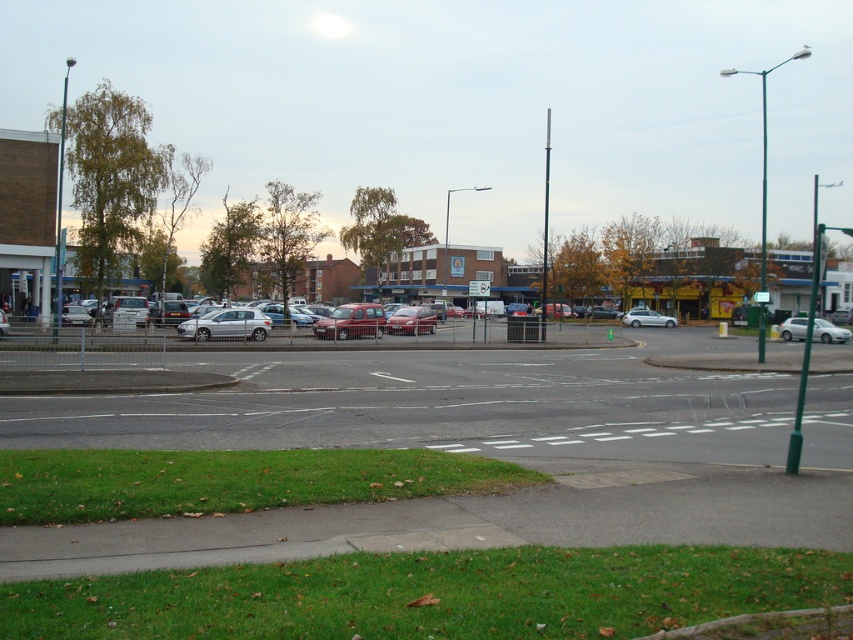
Looking at this image, who is positioned more to the left, white matte car at right or metallic silver car at center?

metallic silver car at center

Is white matte car at right shorter than metallic silver car at center?

Correct, white matte car at right is not as tall as metallic silver car at center.

Which is in front, point (782, 336) or point (418, 307)?

Point (782, 336) is in front.

What are the coordinates of `white matte car at right` in the screenshot? It's located at (828, 332).

Can you confirm if white matte car at right is positioned above silver metallic sedan at center?

Actually, white matte car at right is below silver metallic sedan at center.

What do you see at coordinates (828, 332) in the screenshot?
I see `white matte car at right` at bounding box center [828, 332].

Locate an element on the screen. The width and height of the screenshot is (853, 640). white matte car at right is located at coordinates (828, 332).

Who is more distant from viewer, (231, 332) or (345, 336)?

The point (345, 336) is more distant.

This screenshot has height=640, width=853. Describe the element at coordinates (225, 324) in the screenshot. I see `satin silver hatchback at center` at that location.

You are a GUI agent. You are given a task and a screenshot of the screen. Output one action in this format:
    pyautogui.click(x=<x>, y=<y>)
    Task: Click on the satin silver hatchback at center
    Image resolution: width=853 pixels, height=640 pixels.
    Given the screenshot: What is the action you would take?
    pyautogui.click(x=225, y=324)